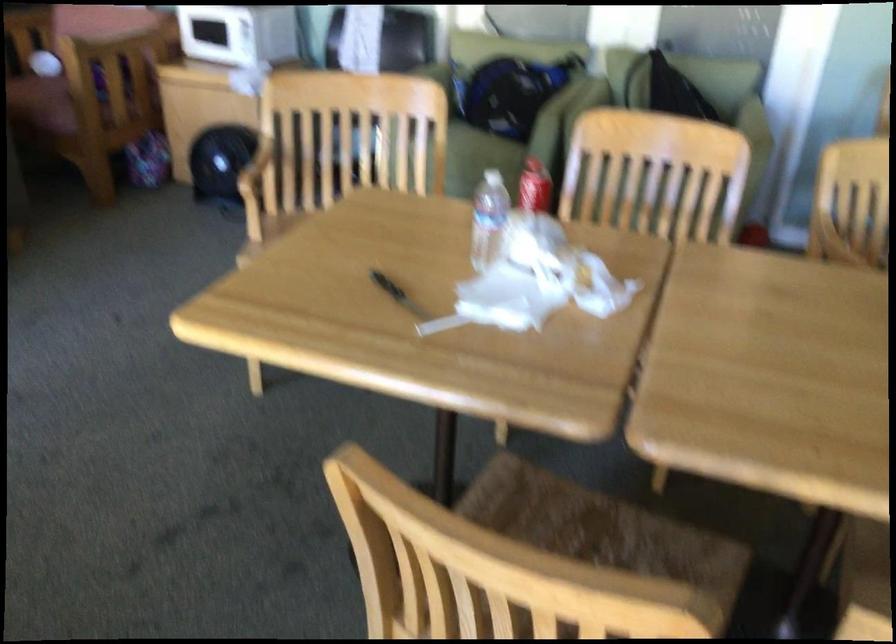
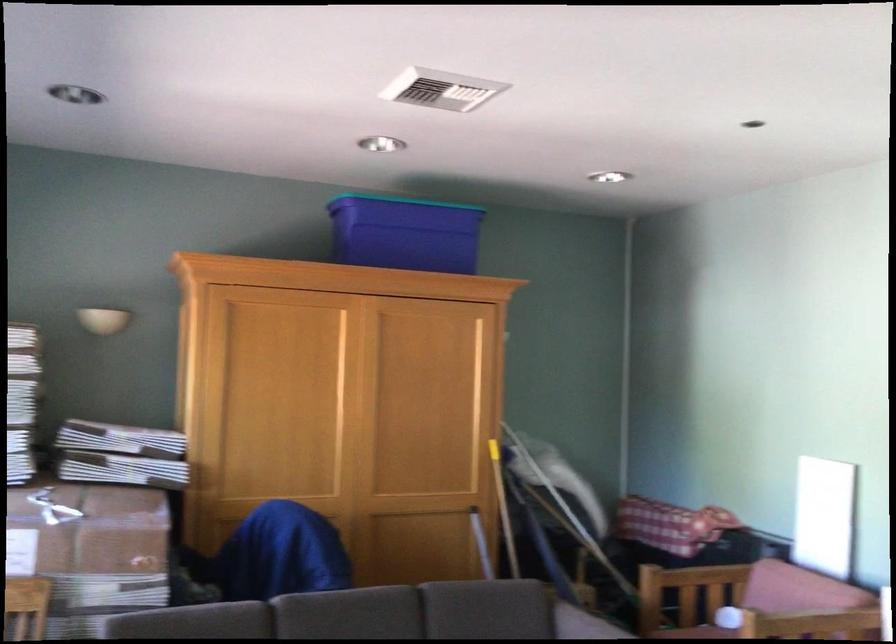
How did the camera likely rotate?

The camera's rotation is toward left-up.